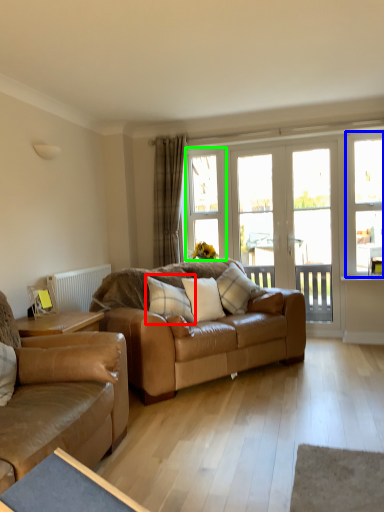
Question: Which is farther away from pillow (highlighted by a red box)? window (highlighted by a blue box) or window (highlighted by a green box)?

Choices:
 (A) window
 (B) window

Answer: (A)